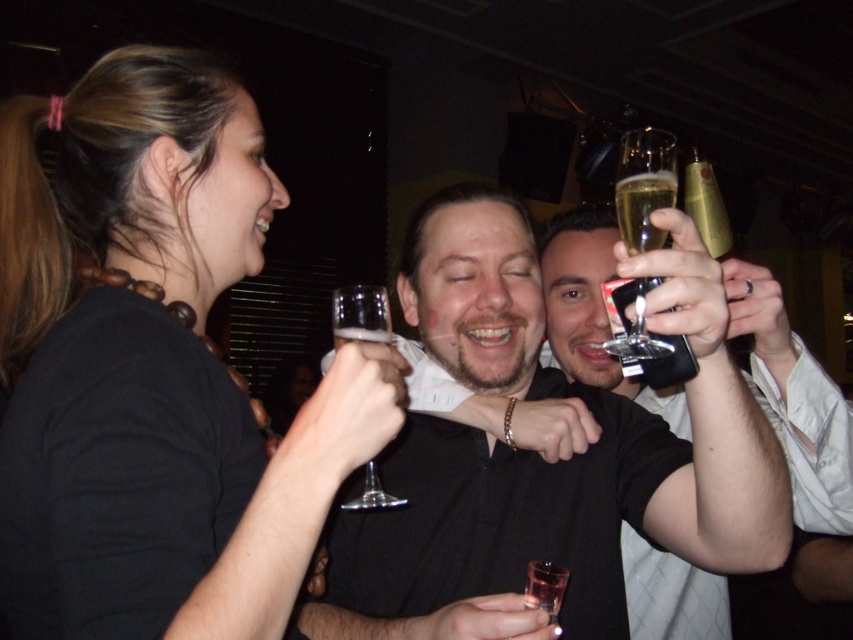
In the scene of a lively toast at a bar or club, there is a clear glass wine glass at center and a gold metallic bottle at upper right. From the perspective of someone standing at the center of the image, which object is positioned to the left?

The clear glass wine glass at center is positioned to the left of the gold metallic bottle at upper right.

You are a photographer at the event and want to take a closeup of the champagne flute held by the man in the black shirt. The point at coordinates (151, 369) is on the matte black shirt at upper left. Based on this information, can you determine if the champagne flute is in the same location as the shirt?

The point at coordinates (151, 369) is on the matte black shirt at upper left, so the champagne flute is not in the same location as the shirt because the coordinates specifically indicate the shirt.

You are at a party and want to take a photo of the shiny black shirt at center and the clear glass wine glass at center. Which object should you focus on first to ensure both are in focus?

The shiny black shirt at center is in front of the clear glass wine glass at center, so you should focus on the shiny black shirt at center first to ensure both are in focus.